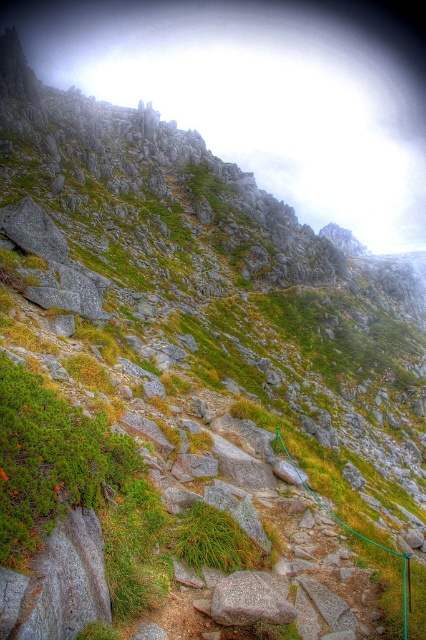
Does point (247, 618) lie in front of point (403, 604)?

Yes, point (247, 618) is closer to viewer.

Does granite rock at center come in front of green rubber rope at center?

That is False.

Which is in front, point (284, 595) or point (405, 634)?

Point (405, 634) is more forward.

Find the location of a particular element. The height and width of the screenshot is (640, 426). granite rock at center is located at coordinates (250, 600).